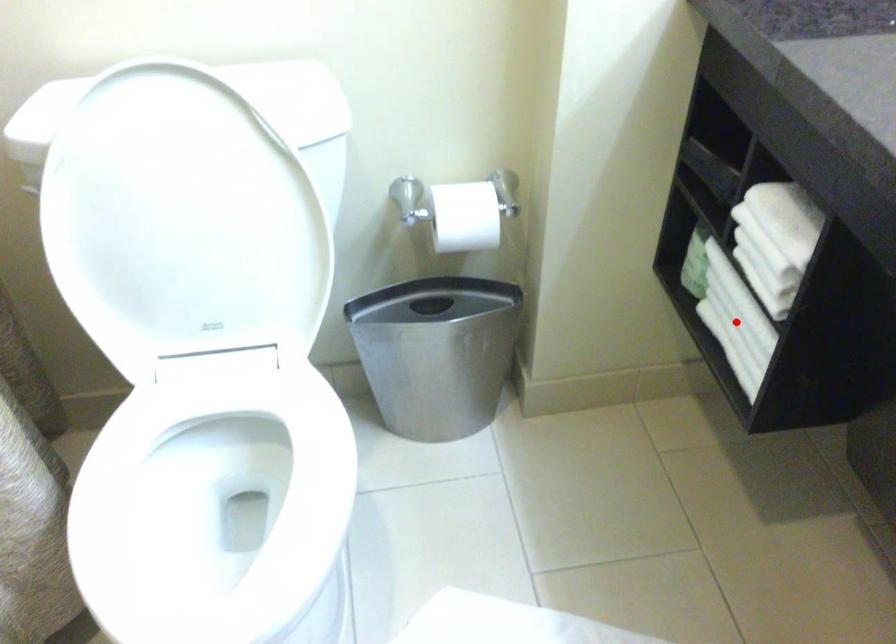
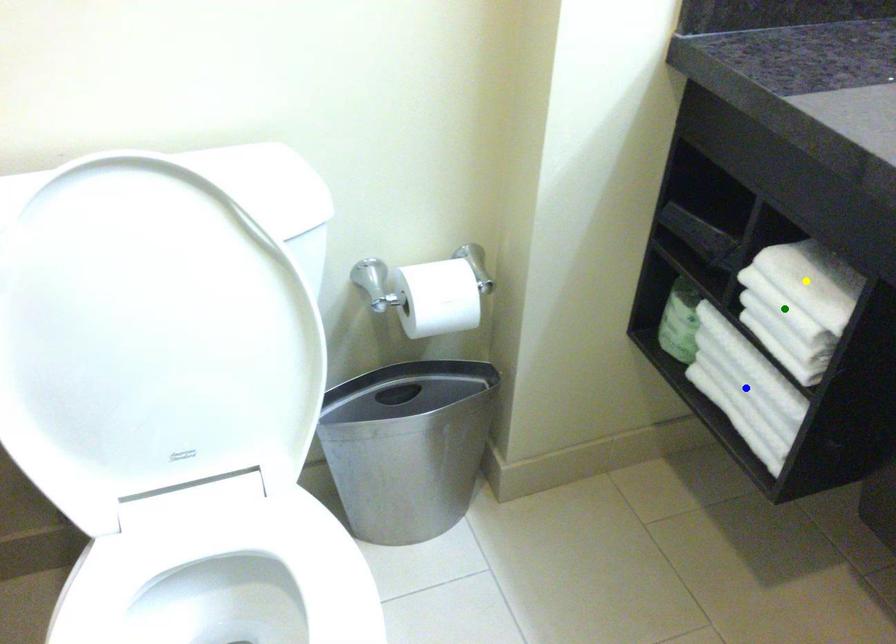
Question: I am providing you with two images of the same scene from different viewpoints. A red point is marked on the first image. You are given multiple points on the second image. Which mark in image 2 goes with the point in image 1?

Choices:
 (A) yellow point
 (B) green point
 (C) blue point

Answer: (C)